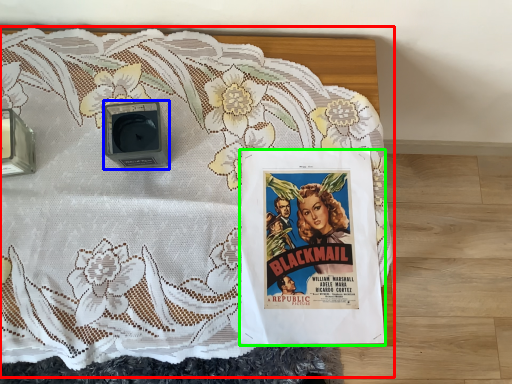
Question: Based on their relative distances, which object is nearer to bed (highlighted by a red box)? Choose from alarm (highlighted by a blue box) and poster (highlighted by a green box).

Choices:
 (A) alarm
 (B) poster

Answer: (B)